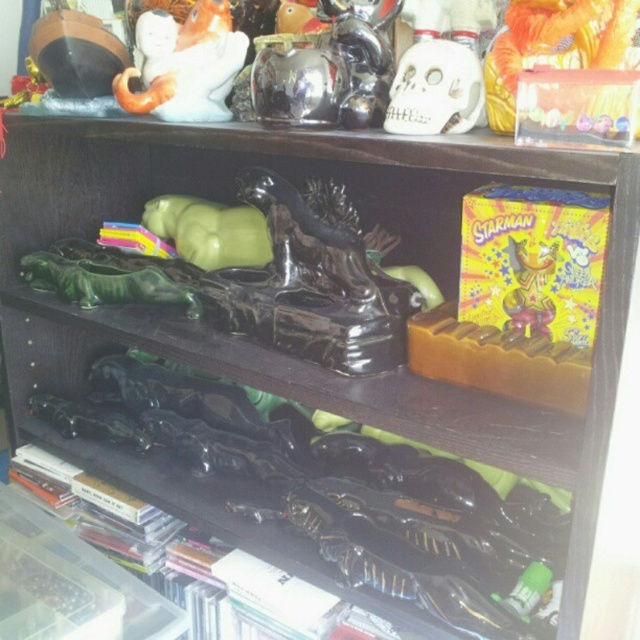
You are organizing a display and need to stack the orange plastic toy at upper right and the shiny yellow plastic toy at upper right vertically. Which toy should be placed at the bottom to ensure stability?

The orange plastic toy at upper right should be placed at the bottom since it has a greater height than the shiny yellow plastic toy at upper right, providing a more stable base.

You are standing in front of a dark wooden shelving unit. There are two points marked on the middle shelf. The first point is at coordinates point (224,99) and the second point is at point (164,228). If you want to place a small sticker on the shelf closer to you, which point should you choose?

Point (224,99) is closer to the camera than point (164,228), so you should choose point (224,99) to place the sticker closer to you.